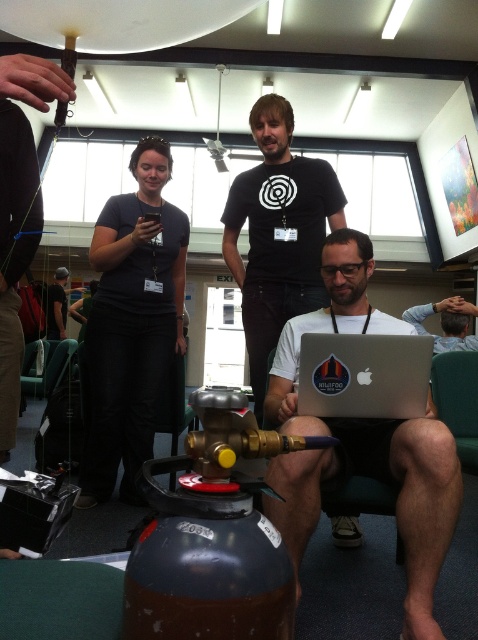
Is point (454, 483) less distant than point (352, 404)?

Yes, it is in front of point (352, 404).

Between white matte laptop at lower center and silver metallic laptop at center, which one is positioned lower?

white matte laptop at lower center

Measure the distance between point (x=428, y=483) and camera.

Point (x=428, y=483) is 1.48 meters from camera.

You are a GUI agent. You are given a task and a screenshot of the screen. Output one action in this format:
    pyautogui.click(x=<x>, y=<y>)
    Task: Click on the white matte laptop at lower center
    The image size is (478, 640).
    Given the screenshot: What is the action you would take?
    pyautogui.click(x=378, y=428)

Does point (253, 189) come farther from viewer compared to point (428, 364)?

Yes, it is.

Does black matte t-shirt at center have a larger size compared to silver metallic laptop at center?

Correct, black matte t-shirt at center is larger in size than silver metallic laptop at center.

What do you see at coordinates (278, 234) in the screenshot? I see `black matte t-shirt at center` at bounding box center [278, 234].

Locate an element on the screen. black matte t-shirt at center is located at coordinates (278, 234).

Is dark gray fabric shirt at upper left positioned before silver metallic laptop at center?

No, dark gray fabric shirt at upper left is behind silver metallic laptop at center.

Does dark gray fabric shirt at upper left appear on the left side of silver metallic laptop at center?

Correct, you'll find dark gray fabric shirt at upper left to the left of silver metallic laptop at center.

Locate an element on the screen. The height and width of the screenshot is (640, 478). dark gray fabric shirt at upper left is located at coordinates (131, 323).